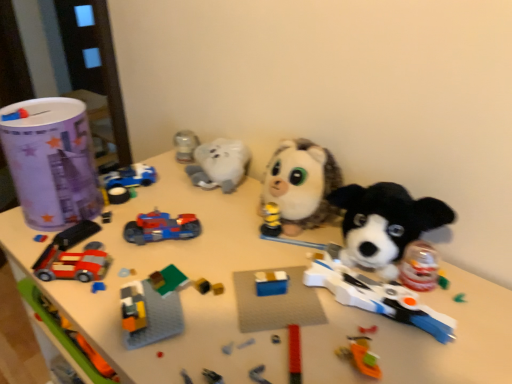
Find the location of a particular element. Image resolution: width=512 pixels, height=384 pixels. free space that is in between shiny plastic toy car at center, the fourth toy positioned from the left, and brick-like plastic car at lower left, the 2th toy in the left-to-right sequence is located at coordinates (121, 254).